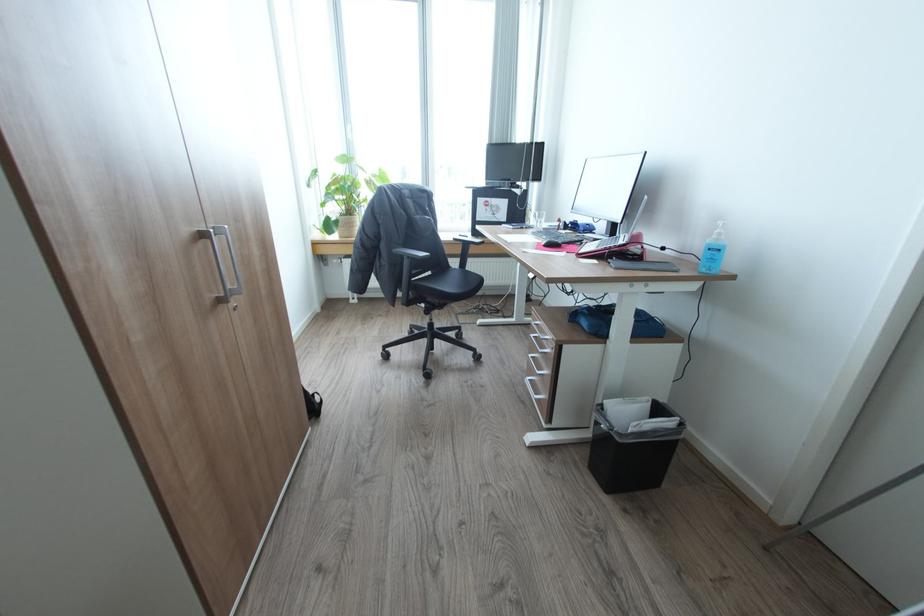
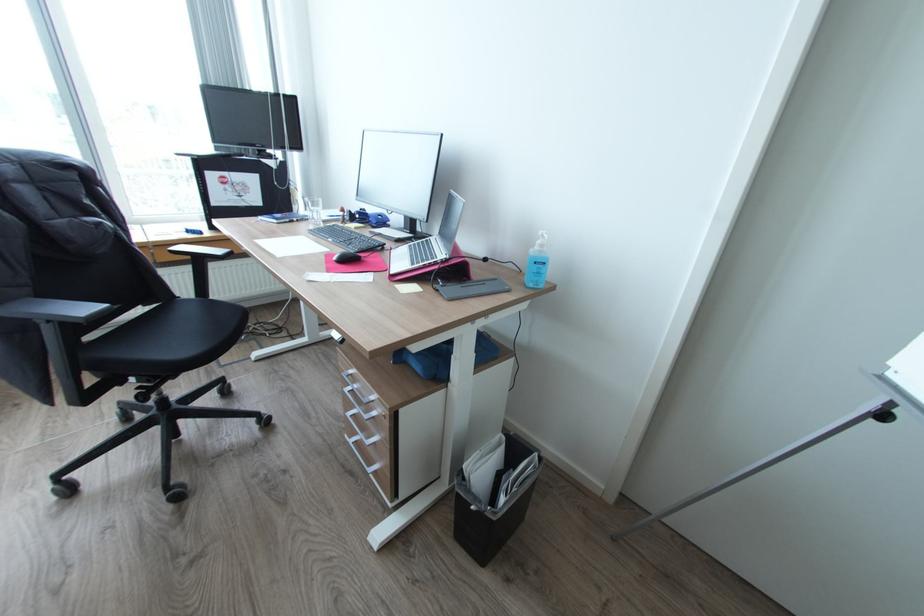
In the second image, find the point that corresponds to (548,243) in the first image.

(339, 257)